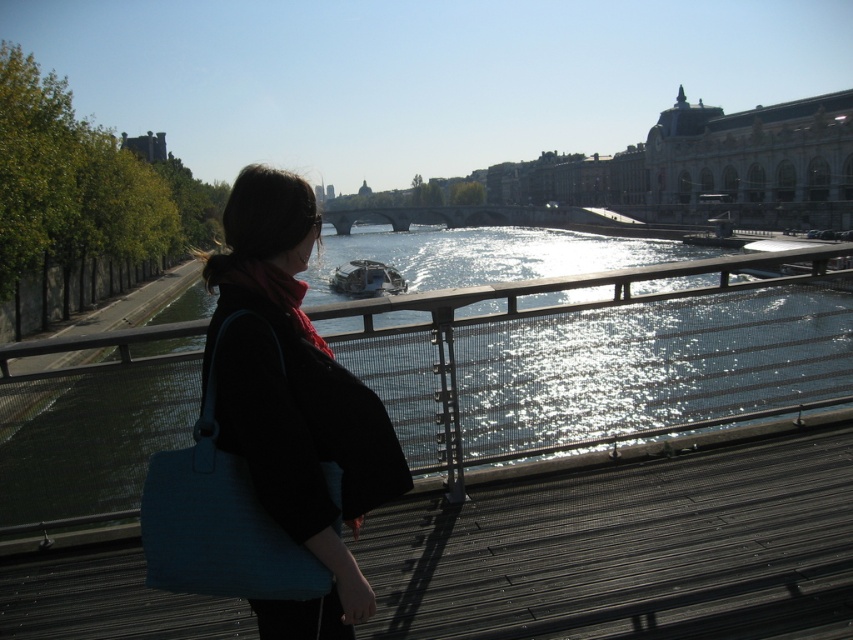
Is greenish water at center shorter than matte black jacket at center?

In fact, greenish water at center may be taller than matte black jacket at center.

Who is taller, greenish water at center or matte black jacket at center?

Standing taller between the two is greenish water at center.

Describe the element at coordinates (602, 355) in the screenshot. I see `greenish water at center` at that location.

You are a GUI agent. You are given a task and a screenshot of the screen. Output one action in this format:
    pyautogui.click(x=<x>, y=<y>)
    Task: Click on the greenish water at center
    This screenshot has width=853, height=640.
    Given the screenshot: What is the action you would take?
    pyautogui.click(x=602, y=355)

Does point (724, 388) come closer to viewer compared to point (399, 230)?

Yes, point (724, 388) is in front of point (399, 230).

Is point (753, 390) positioned behind point (373, 211)?

That is False.

Between point (680, 252) and point (459, 211), which one is positioned behind?

The point (459, 211) is behind.

Image resolution: width=853 pixels, height=640 pixels. I want to click on greenish water at center, so click(x=602, y=355).

Looking at this image, can you confirm if matte black jacket at center is positioned above stone bridge at center?

Incorrect, matte black jacket at center is not positioned above stone bridge at center.

Can you confirm if matte black jacket at center is wider than stone bridge at center?

In fact, matte black jacket at center might be narrower than stone bridge at center.

I want to click on matte black jacket at center, so click(293, 401).